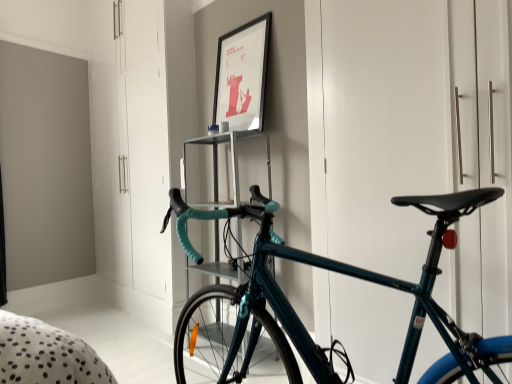
Locate an element on the screen. matte black picture frame at upper center is located at coordinates (242, 75).

Locate an element on the screen. This screenshot has width=512, height=384. teal glossy bicycle at center is located at coordinates (347, 275).

Are teal glossy bicycle at right and matte black picture frame at upper center far apart?

teal glossy bicycle at right is positioned a significant distance from matte black picture frame at upper center.

Is teal glossy bicycle at right thinner than matte black picture frame at upper center?

In fact, teal glossy bicycle at right might be wider than matte black picture frame at upper center.

From a real-world perspective, is teal glossy bicycle at right beneath matte black picture frame at upper center?

Yes, from a real-world perspective, teal glossy bicycle at right is below matte black picture frame at upper center.

Based on the photo, between metallic silver shelf at center and white glossy dresser at center, which one has larger width?

metallic silver shelf at center.

Does point (231, 204) lie behind point (95, 84)?

No, it is in front of (95, 84).

From the image's perspective, relative to white glossy dresser at center, is metallic silver shelf at center above or below?

From the image's perspective, metallic silver shelf at center appears below white glossy dresser at center.

From the picture: Is metallic silver shelf at center positioned with its back to white glossy dresser at center?

No, metallic silver shelf at center is not facing away from white glossy dresser at center.

The height and width of the screenshot is (384, 512). I want to click on dresser above the teal glossy bicycle at center (from the image's perspective), so click(131, 155).

Considering the positions of objects white glossy dresser at center and teal glossy bicycle at center in the image provided, who is more to the left, white glossy dresser at center or teal glossy bicycle at center?

Positioned to the left is white glossy dresser at center.

Based on the photo, does white glossy dresser at center turn towards teal glossy bicycle at center?

No, white glossy dresser at center is not oriented towards teal glossy bicycle at center.

From a real-world perspective, relative to teal glossy bicycle at center, is white glossy dresser at center vertically above or below?

Clearly, from a real-world perspective, white glossy dresser at center is above teal glossy bicycle at center.

Would you consider matte black picture frame at upper center to be distant from teal glossy bicycle at center?

Yes, matte black picture frame at upper center and teal glossy bicycle at center are located far from each other.

Looking at this image, from the image's perspective, is matte black picture frame at upper center on teal glossy bicycle at center?

Correct, matte black picture frame at upper center appears higher than teal glossy bicycle at center in the image.

Can you confirm if matte black picture frame at upper center is wider than teal glossy bicycle at center?

Incorrect, the width of matte black picture frame at upper center does not surpass that of teal glossy bicycle at center.

Does matte black picture frame at upper center come behind teal glossy bicycle at center?

That is True.

From the picture: Is white glossy dresser at center inside matte black picture frame at upper center?

No, white glossy dresser at center is not a part of matte black picture frame at upper center.

From a real-world perspective, relative to white glossy dresser at center, is matte black picture frame at upper center vertically above or below?

matte black picture frame at upper center is above white glossy dresser at center.

From the image's perspective, who appears lower, matte black picture frame at upper center or white glossy dresser at center?

white glossy dresser at center, from the image's perspective.

Looking at their sizes, would you say matte black picture frame at upper center is wider or thinner than white glossy dresser at center?

matte black picture frame at upper center is thinner than white glossy dresser at center.

How many degrees apart are the facing directions of teal glossy bicycle at center and white glossy dresser at center?

They differ by 87.9 degrees in their facing directions.

From the image's perspective, which is above, teal glossy bicycle at center or white glossy dresser at center?

From the image's view, white glossy dresser at center is above.

Is teal glossy bicycle at center placed right next to white glossy dresser at center?

No, teal glossy bicycle at center is not making contact with white glossy dresser at center.

Considering the relative sizes of teal glossy bicycle at center and white glossy dresser at center in the image provided, is teal glossy bicycle at center bigger than white glossy dresser at center?

Actually, teal glossy bicycle at center might be smaller than white glossy dresser at center.

I want to click on bicycle below the matte black picture frame at upper center (from the image's perspective), so click(347, 275).

Between teal glossy bicycle at center and matte black picture frame at upper center, which one has less height?

matte black picture frame at upper center is shorter.

What's the angular difference between teal glossy bicycle at center and matte black picture frame at upper center's facing directions?

They differ by 88.4 degrees in their facing directions.

Would you say matte black picture frame at upper center is part of teal glossy bicycle at center's contents?

No, matte black picture frame at upper center is not surrounded by teal glossy bicycle at center.

Locate an element on the screen. picture frame on the left of teal glossy bicycle at right is located at coordinates (242, 75).

This screenshot has height=384, width=512. What are the coordinates of `dresser above the metallic silver shelf at center (from the image's perspective)` in the screenshot? It's located at [x=131, y=155].

When comparing their distances from white glossy dresser at center, does matte black picture frame at upper center or teal glossy bicycle at right seem closer?

Among the two, matte black picture frame at upper center is located nearer to white glossy dresser at center.

Based on their spatial positions, is matte black picture frame at upper center or teal glossy bicycle at right closer to teal glossy bicycle at center?

Based on the image, teal glossy bicycle at right appears to be nearer to teal glossy bicycle at center.

Looking at the image, which one is located further to white glossy dresser at center, metallic silver shelf at center or teal glossy bicycle at center?

teal glossy bicycle at center lies further to white glossy dresser at center than the other object.

Estimate the real-world distances between objects in this image. Which object is closer to teal glossy bicycle at center, white glossy dresser at center or matte black picture frame at upper center?

The object closer to teal glossy bicycle at center is matte black picture frame at upper center.

Estimate the real-world distances between objects in this image. Which object is closer to white glossy dresser at center, teal glossy bicycle at center or teal glossy bicycle at right?

teal glossy bicycle at right lies closer to white glossy dresser at center than the other object.

Estimate the real-world distances between objects in this image. Which object is further from matte black picture frame at upper center, white glossy dresser at center or teal glossy bicycle at center?

teal glossy bicycle at center is positioned further to the anchor matte black picture frame at upper center.

When comparing their distances from teal glossy bicycle at center, does white glossy dresser at center or teal glossy bicycle at right seem further?

white glossy dresser at center.

Estimate the real-world distances between objects in this image. Which object is further from teal glossy bicycle at center, metallic silver shelf at center or matte black picture frame at upper center?

matte black picture frame at upper center is positioned further to the anchor teal glossy bicycle at center.

The image size is (512, 384). Find the location of `shelf between teal glossy bicycle at right and matte black picture frame at upper center from front to back`. shelf between teal glossy bicycle at right and matte black picture frame at upper center from front to back is located at coordinates (217, 165).

This screenshot has height=384, width=512. What are the coordinates of `door between teal glossy bicycle at center and white glossy dresser at center along the z-axis` in the screenshot? It's located at (384, 128).

Find the location of a particular element. This screenshot has height=384, width=512. door positioned between teal glossy bicycle at center and matte black picture frame at upper center from near to far is located at coordinates (384, 128).

You are a GUI agent. You are given a task and a screenshot of the screen. Output one action in this format:
    pyautogui.click(x=<x>, y=<y>)
    Task: Click on the shelf positioned between teal glossy bicycle at right and white glossy dresser at center from near to far
    The height and width of the screenshot is (384, 512).
    Given the screenshot: What is the action you would take?
    pyautogui.click(x=217, y=165)